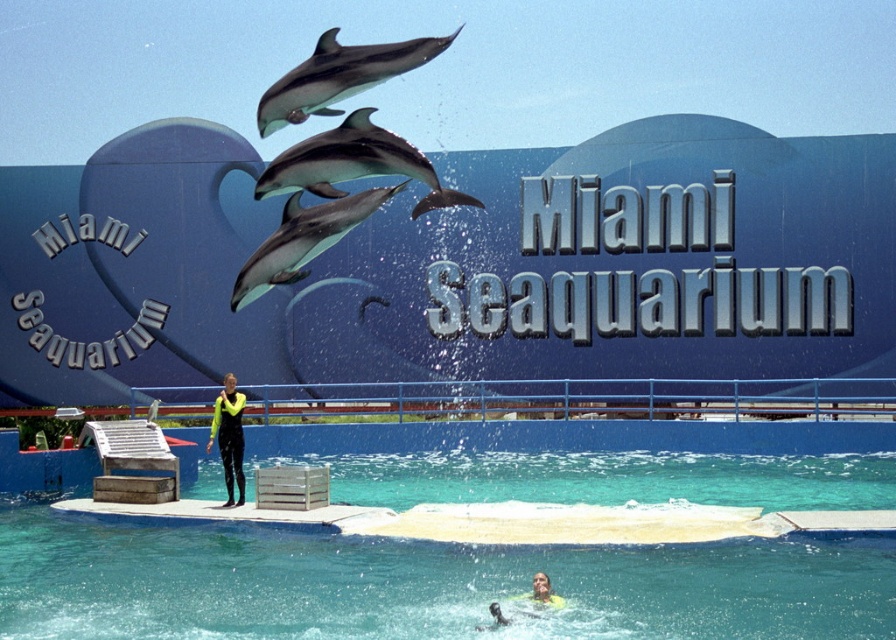
You are a visitor at the Miami Seaquarium and want to take a photo of the smooth gray dolphin at center and the neon yellow wetsuit at center. Which object will appear larger in your photo?

The smooth gray dolphin at center will appear larger in your photo because it is closer to the viewer than the neon yellow wetsuit at center.